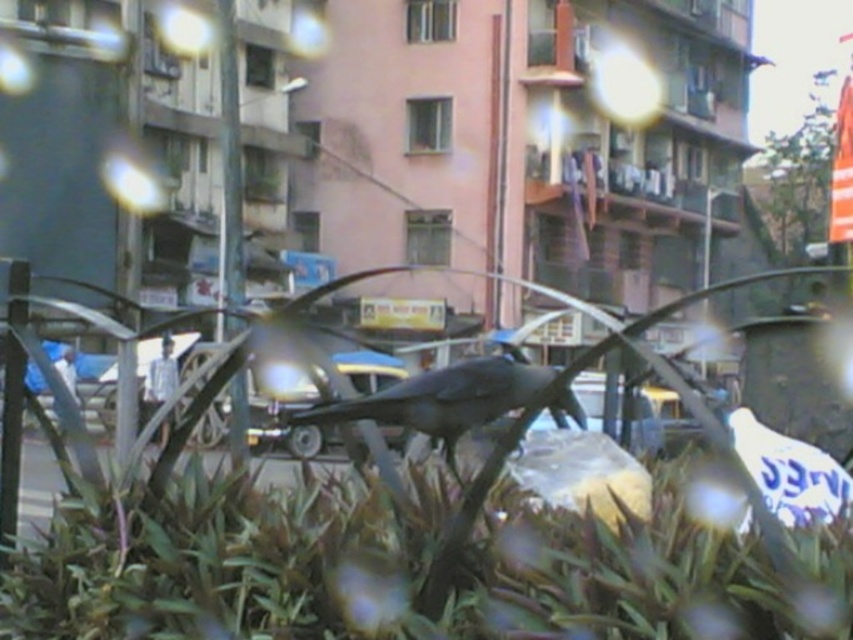
You are a birdwatcher trying to observe the shiny black bird at center. There is a green leafy plant at center below it. Can you confirm if the bird is perched above the plant?

The green leafy plant at center is positioned under the shiny black bird at center, so yes, the bird is perched above the plant.

You are a photographer trying to capture a clear shot of the shiny black bird at center. However, the green leafy plant at center is in the way. Can you adjust your position to avoid the plant while still keeping the bird in the frame?

The green leafy plant at center is positioned on the left side of the shiny black bird at center. Therefore, moving to the right side of the current position would allow you to avoid the plant while keeping the bird in the frame.

You are a photographer trying to capture a clear shot of the shiny black bird at center and the green leafy plant at center. Considering the blurred effect from the textured surface, which object would be easier to focus on and why?

The shiny black bird at center would be easier to focus on because it is positioned centrally and has darker, more defined features compared to the green leafy plant at center, which is much taller and might be more affected by the blurred texture.